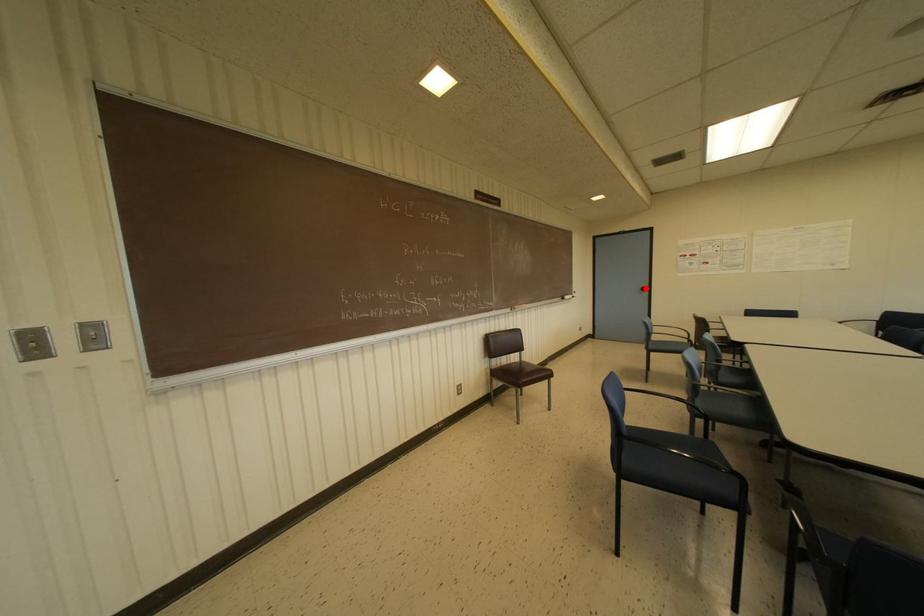
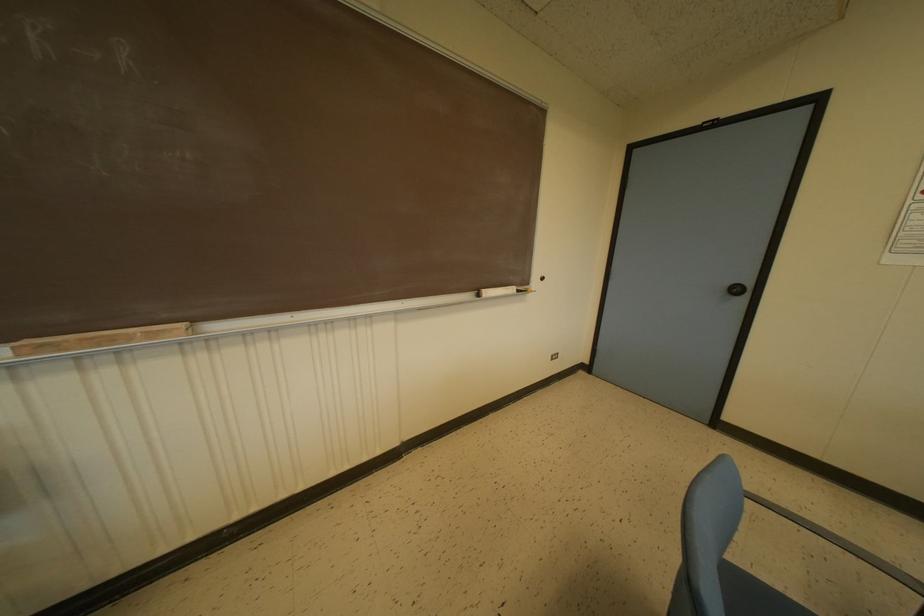
The point at the highlighted location is marked in the first image. Where is the corresponding point in the second image?

(746, 291)